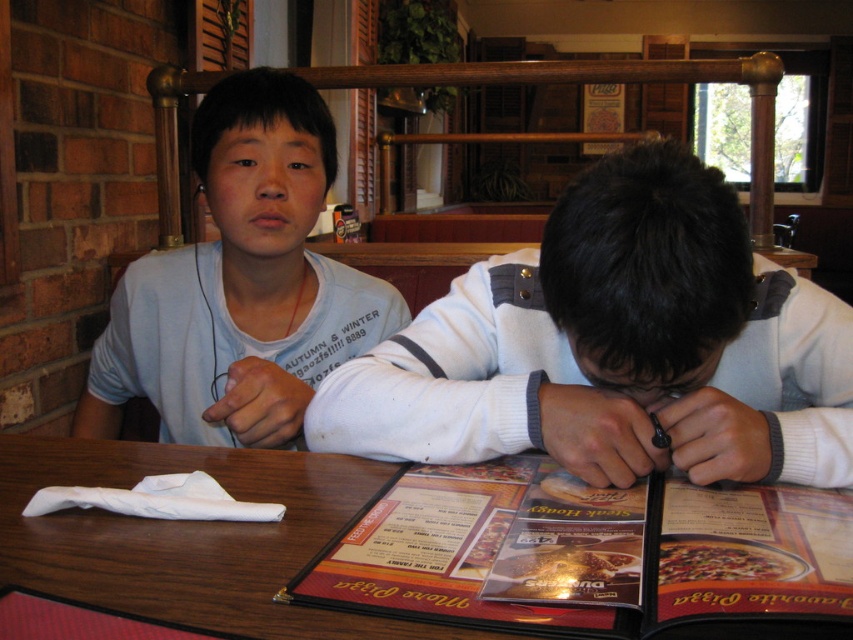
You are a customer at the restaurant and want to read the matte plastic menu at center without moving the white knit sweater at center. Is it possible to see the menu clearly from your current position?

The matte plastic menu at center is behind the white knit sweater at center, so it might be partially or fully obstructed, making it difficult to read without moving the sweater.

Consider the image. You are a server at the restaurant and need to place a 10 cm wide drink coaster between the matte plastic menu at center and the white cotton shirt at upper left. Can you fit it there?

The matte plastic menu at center is narrower than the white cotton shirt at upper left. Since the coaster is 10 cm wide, you need to check the available space between them. However, the description only provides their widths relative to each other, not the exact distance between them. Without knowing the actual distance between the two objects, it is impossible to determine if the coaster will fit.

You are a photographer trying to capture a closeup of the white knit sweater at center and the white cotton shirt at upper left. Which one will appear larger in your photo?

The white knit sweater at center will appear larger in the photo because it is closer to the viewer than the white cotton shirt at upper left.